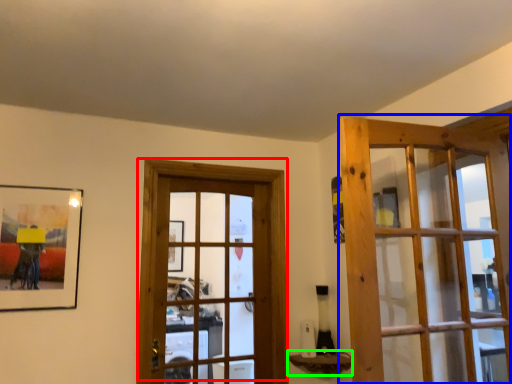
Question: Based on their relative distances, which object is farther from door (highlighted by a red box)? Choose from door (highlighted by a blue box) and window sill (highlighted by a green box).

Choices:
 (A) door
 (B) window sill

Answer: (A)